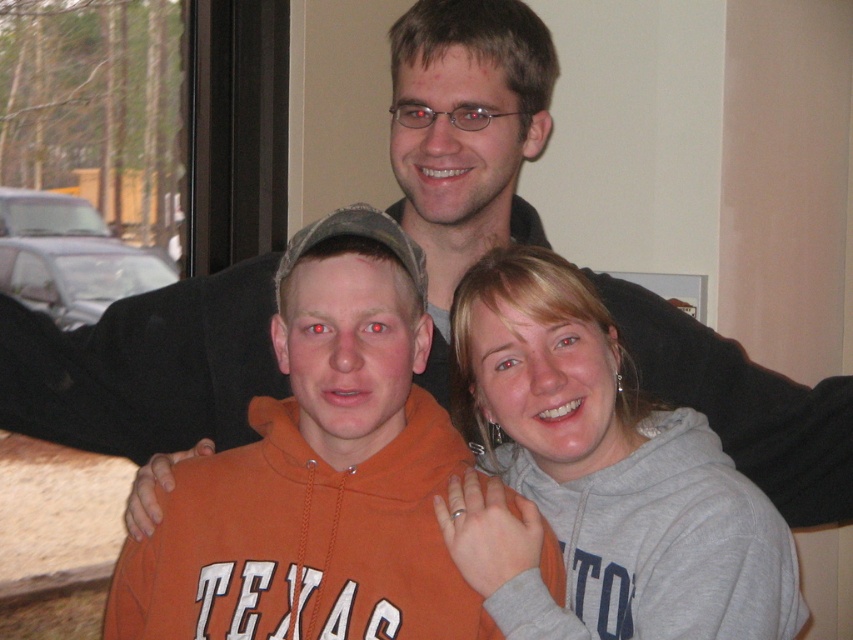
You are a photographer trying to adjust the lighting in the room to ensure both the orange fleece sweatshirt at center and the gray fleece sweatshirt at lower right are well lit. Based on their positions, which one might require more adjustment to ensure it is properly illuminated?

The gray fleece sweatshirt at lower right might require more adjustment because it is positioned under the orange fleece sweatshirt at center, potentially blocking some light from reaching it.